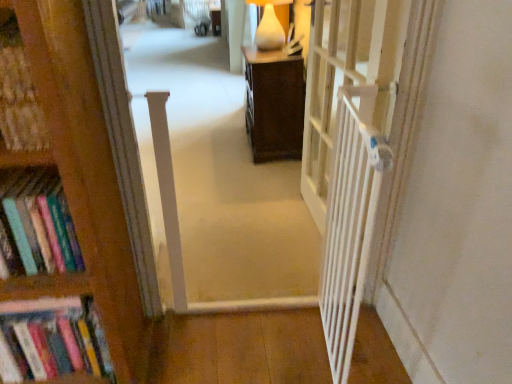
Image resolution: width=512 pixels, height=384 pixels. In order to click on white wooden gate at right in this screenshot , I will do `click(349, 221)`.

What do you see at coordinates (347, 78) in the screenshot?
I see `white plastic gate at right` at bounding box center [347, 78].

At what (x,y) coordinates should I click in order to perform the action: click on hardcover books at left. Please return your answer as a coordinate pair (x, y). The height and width of the screenshot is (384, 512). Looking at the image, I should click on (52, 341).

Consider the image. Based on their positions, is white wooden gate at right located to the left or right of hardcover books at left?

white wooden gate at right is positioned on hardcover books at left's right side.

Does white wooden gate at right have a lesser height compared to hardcover books at left?

Incorrect, the height of white wooden gate at right does not fall short of that of hardcover books at left.

Identify the location of balustrade that appears above the hardcover books at left (from the image's perspective). This screenshot has height=384, width=512. (349, 221).

Is white matte table lamp at upper center aimed at hardcover books at left?

No, white matte table lamp at upper center does not turn towards hardcover books at left.

Is white matte table lamp at upper center situated inside hardcover books at left or outside?

white matte table lamp at upper center is not enclosed by hardcover books at left.

Does point (268, 6) lie behind point (35, 380)?

Yes.

From a real-world perspective, which object rests below the other?

From a 3D spatial view, white wooden gate at right is below.

Based on their sizes in the image, would you say white wooden gate at right is bigger or smaller than white plastic gate at right?

white wooden gate at right is smaller than white plastic gate at right.

What are the coordinates of `door above the white wooden gate at right (from the image's perspective)` in the screenshot? It's located at (347, 78).

Considering the relative sizes of white wooden gate at right and white matte table lamp at upper center in the image provided, is white wooden gate at right shorter than white matte table lamp at upper center?

In fact, white wooden gate at right may be taller than white matte table lamp at upper center.

Could you tell me if white wooden gate at right is facing white matte table lamp at upper center?

No, white wooden gate at right does not turn towards white matte table lamp at upper center.

Considering the positions of objects white wooden gate at right and white matte table lamp at upper center in the image provided, who is more to the left, white wooden gate at right or white matte table lamp at upper center?

white matte table lamp at upper center is more to the left.

Locate an element on the screen. This screenshot has height=384, width=512. table lamp positioned vertically above the white wooden gate at right (from a real-world perspective) is located at coordinates (269, 25).

Is white matte table lamp at upper center facing away from white plastic gate at center?

No, white matte table lamp at upper center is not facing away from white plastic gate at center.

Is white matte table lamp at upper center to the left of white plastic gate at center from the viewer's perspective?

Incorrect, white matte table lamp at upper center is not on the left side of white plastic gate at center.

The image size is (512, 384). I want to click on table lamp positioned vertically above the white plastic gate at center (from a real-world perspective), so click(269, 25).

Is white matte table lamp at upper center thinner than white plastic gate at center?

Result: Correct, the width of white matte table lamp at upper center is less than that of white plastic gate at center.

Identify the location of corridor located above the white wooden gate at right (from the image's perspective). (216, 183).

Is white wooden gate at right positioned with its back to white plastic gate at center?

No, white wooden gate at right's orientation is not away from white plastic gate at center.

From a real-world perspective, which object rests below the other?

white plastic gate at center.

Between hardcover books at left and white plastic gate at center, which one has more height?

white plastic gate at center is taller.

This screenshot has width=512, height=384. Identify the location of book lying in front of the white plastic gate at center. (52, 341).

From a real-world perspective, is hardcover books at left positioned above or below white plastic gate at center?

hardcover books at left is situated lower than white plastic gate at center in the real world.

Considering the sizes of hardcover books at left and white plastic gate at center in the image, is hardcover books at left wider or thinner than white plastic gate at center?

hardcover books at left is thinner than white plastic gate at center.

At what (x,y) coordinates should I click in order to perform the action: click on balustrade that appears in front of the hardcover books at left. Please return your answer as a coordinate pair (x, y). Looking at the image, I should click on (349, 221).

This screenshot has width=512, height=384. I want to click on table lamp that appears above the hardcover books at left (from a real-world perspective), so click(x=269, y=25).

From the image, which object appears to be farther from white wooden gate at right, white plastic gate at right or white matte table lamp at upper center?

Based on the image, white matte table lamp at upper center appears to be further to white wooden gate at right.

Estimate the real-world distances between objects in this image. Which object is closer to hardcover books at left, white matte table lamp at upper center or white plastic gate at right?

white plastic gate at right is closer to hardcover books at left.

Consider the image. Based on their spatial positions, is white plastic gate at center or white plastic gate at right further from white wooden gate at right?

white plastic gate at center.

Based on their spatial positions, is white plastic gate at center or hardcover books at left closer to white plastic gate at right?

white plastic gate at center.

Estimate the real-world distances between objects in this image. Which object is further from white wooden gate at right, hardcover books at left or white plastic gate at right?

hardcover books at left is positioned further to the anchor white wooden gate at right.

Which object lies nearer to the anchor point white wooden gate at right, white matte table lamp at upper center or white plastic gate at center?

white plastic gate at center is positioned closer to the anchor white wooden gate at right.

Estimate the real-world distances between objects in this image. Which object is further from hardcover books at left, white plastic gate at center or white wooden gate at right?

Among the two, white wooden gate at right is located further to hardcover books at left.

When comparing their distances from white matte table lamp at upper center, does hardcover books at left or white plastic gate at center seem closer?

Among the two, white plastic gate at center is located nearer to white matte table lamp at upper center.

Identify the location of door between white wooden gate at right and white matte table lamp at upper center from front to back. (347, 78).

I want to click on balustrade between hardcover books at left and white plastic gate at right, so click(349, 221).

Identify the location of corridor between hardcover books at left and white plastic gate at right from left to right. Image resolution: width=512 pixels, height=384 pixels. (216, 183).

Find the location of `corridor between white plastic gate at right and white wooden gate at right vertically`. corridor between white plastic gate at right and white wooden gate at right vertically is located at coordinates pyautogui.click(x=216, y=183).